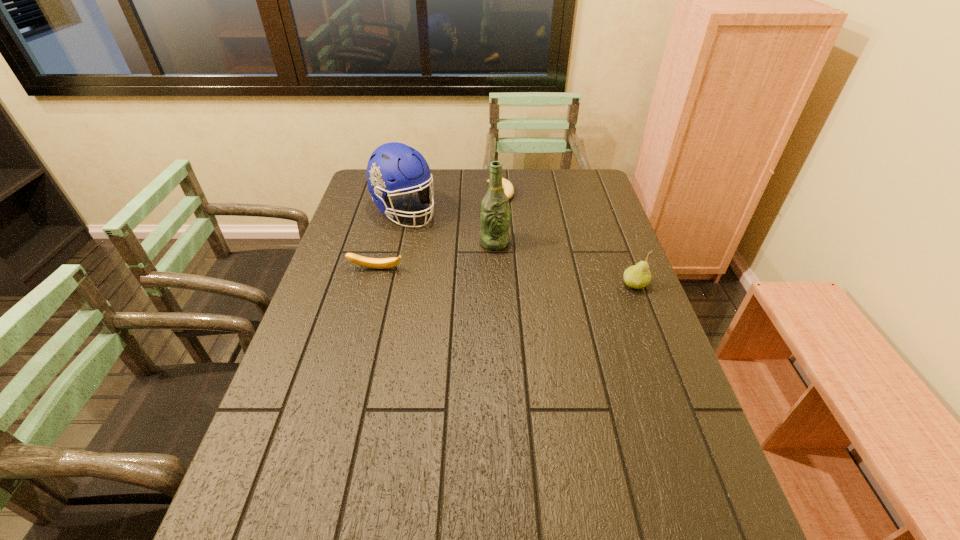
At what (x,y) coordinates should I click in order to perform the action: click on banana that is at the far edge. Please return your answer as a coordinate pair (x, y). Looking at the image, I should click on (508, 188).

Where is `banana located at the left edge`? This screenshot has height=540, width=960. banana located at the left edge is located at coordinates (378, 263).

At what (x,y) coordinates should I click in order to perform the action: click on football helmet that is positioned at the left edge. Please return your answer as a coordinate pair (x, y). The height and width of the screenshot is (540, 960). Looking at the image, I should click on (393, 167).

Locate an element on the screen. The height and width of the screenshot is (540, 960). object that is at the right edge is located at coordinates (638, 276).

The width and height of the screenshot is (960, 540). What are the coordinates of `object at the far left corner` in the screenshot? It's located at (x=393, y=167).

Where is `vacant space at the far edge of the desktop`? This screenshot has height=540, width=960. vacant space at the far edge of the desktop is located at coordinates (473, 184).

In the image, there is a desktop. Where is `vacant space at the near edge`? The height and width of the screenshot is (540, 960). vacant space at the near edge is located at coordinates (492, 463).

Where is `vacant space at the left edge`? Image resolution: width=960 pixels, height=540 pixels. vacant space at the left edge is located at coordinates (352, 251).

At what (x,y) coordinates should I click in order to perform the action: click on free space at the right edge. Please return your answer as a coordinate pair (x, y). Image resolution: width=960 pixels, height=540 pixels. Looking at the image, I should click on (643, 332).

Locate an element on the screen. Image resolution: width=960 pixels, height=540 pixels. vacant area that lies between the fourth tallest object and the football helmet is located at coordinates (391, 240).